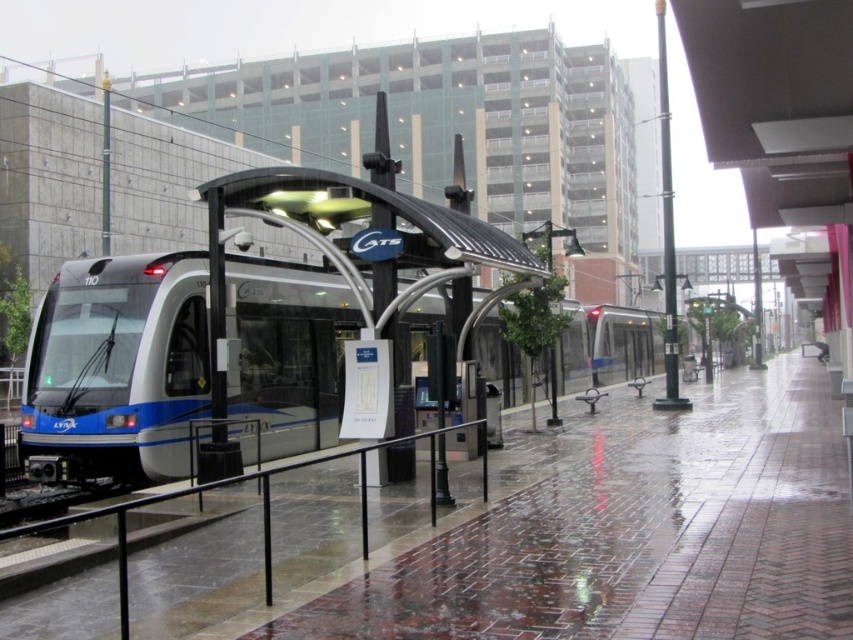
Is metallic blue train at left below black metal/rail at lower left?

Incorrect, metallic blue train at left is not positioned below black metal/rail at lower left.

Is metallic blue train at left thinner than black metal/rail at lower left?

In fact, metallic blue train at left might be wider than black metal/rail at lower left.

At what (x,y) coordinates should I click in order to perform the action: click on metallic blue train at left. Please return your answer as a coordinate pair (x, y). This screenshot has width=853, height=640. Looking at the image, I should click on (119, 365).